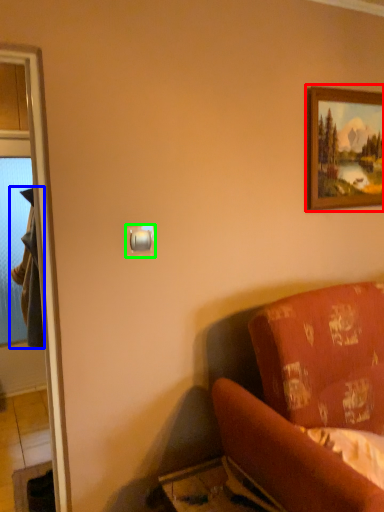
Question: Which object is positioned farthest from picture frame (highlighted by a red box)? Select from robe (highlighted by a blue box) and light switch (highlighted by a green box).

Choices:
 (A) robe
 (B) light switch

Answer: (A)